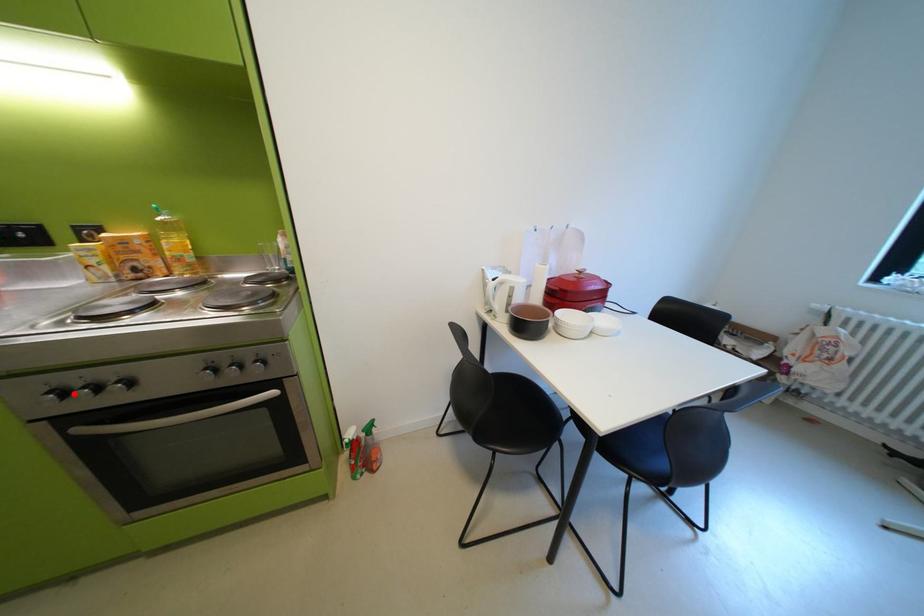
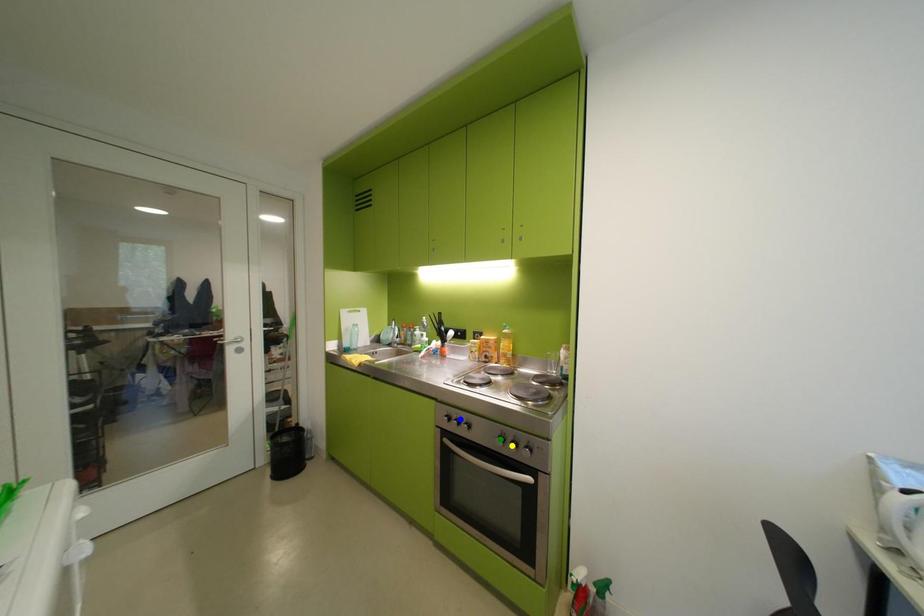
Question: I am providing you with two images of the same scene from different viewpoints. A red point is marked on the first image. You are given multiple points on the second image. Which point in image 2 is actually the same real-world point as the red point in image 1?

Choices:
 (A) green point
 (B) blue point
 (C) yellow point

Answer: (B)